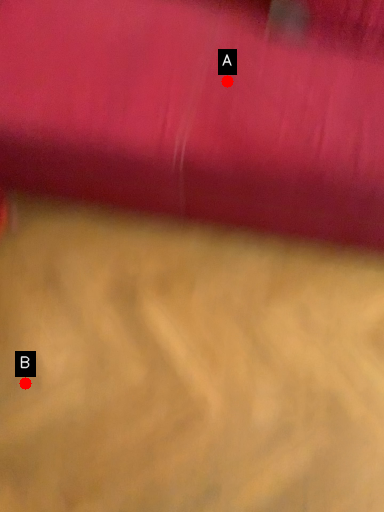
Question: Two points are circled on the image, labeled by A and B beside each circle. Which point is farther from the camera taking this photo?

Choices:
 (A) A is further
 (B) B is further

Answer: (A)